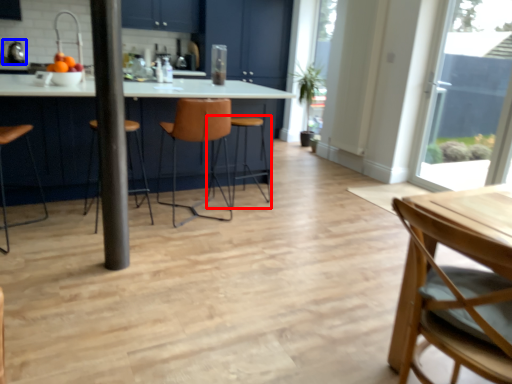
Question: Which of the following is the closest to the observer, bar stool (highlighted by a red box) or appliance (highlighted by a blue box)?

Choices:
 (A) bar stool
 (B) appliance

Answer: (A)